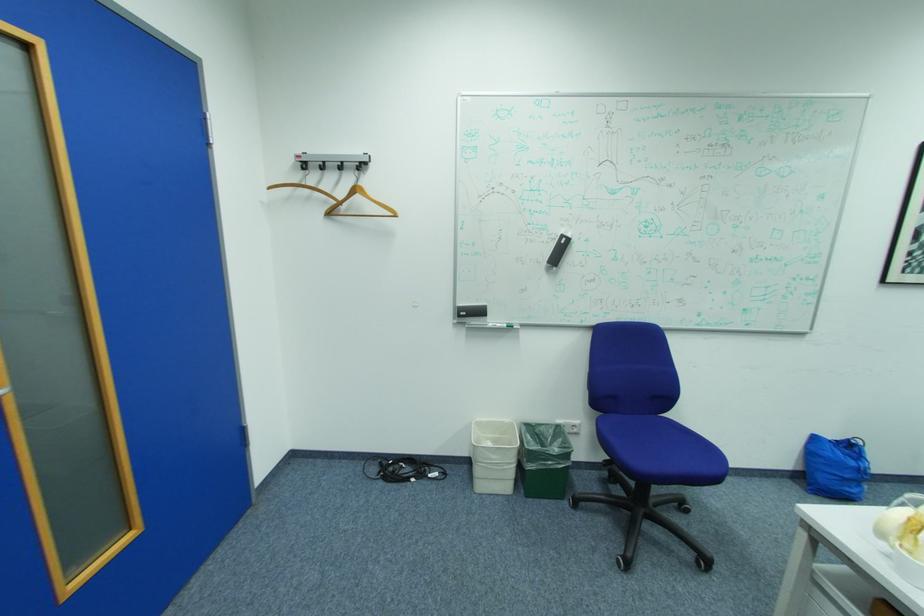
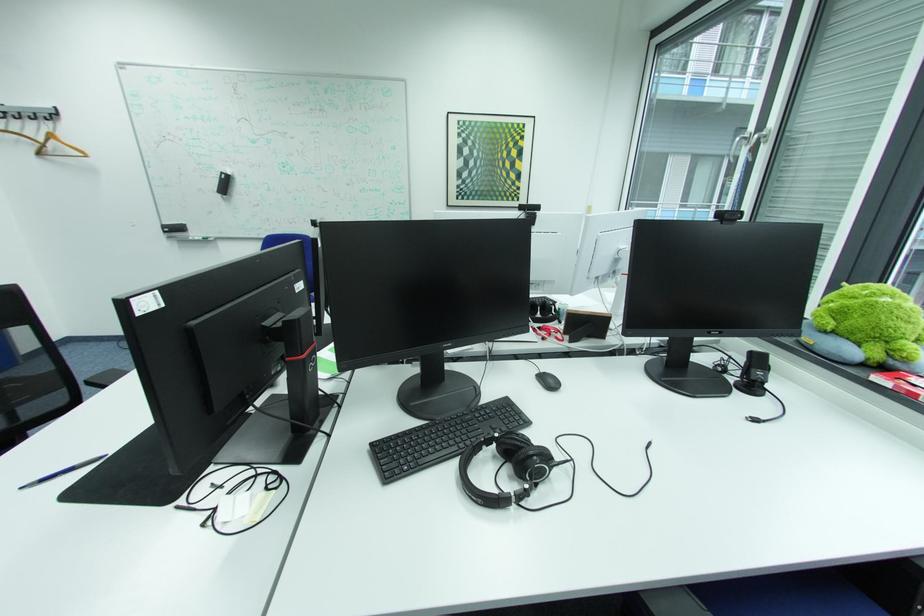
The point at [795,265] is marked in the first image. Where is the corresponding point in the second image?

(393, 195)